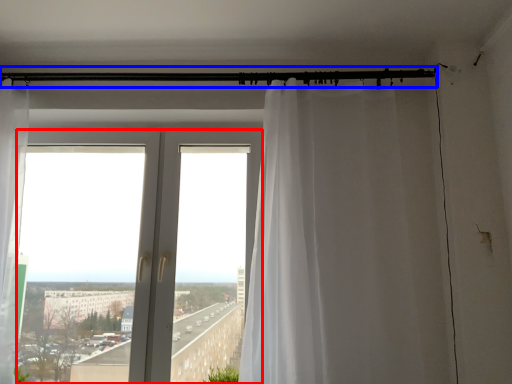
Question: Which object is closer to the camera taking this photo, window (highlighted by a red box) or beam (highlighted by a blue box)?

Choices:
 (A) window
 (B) beam

Answer: (A)